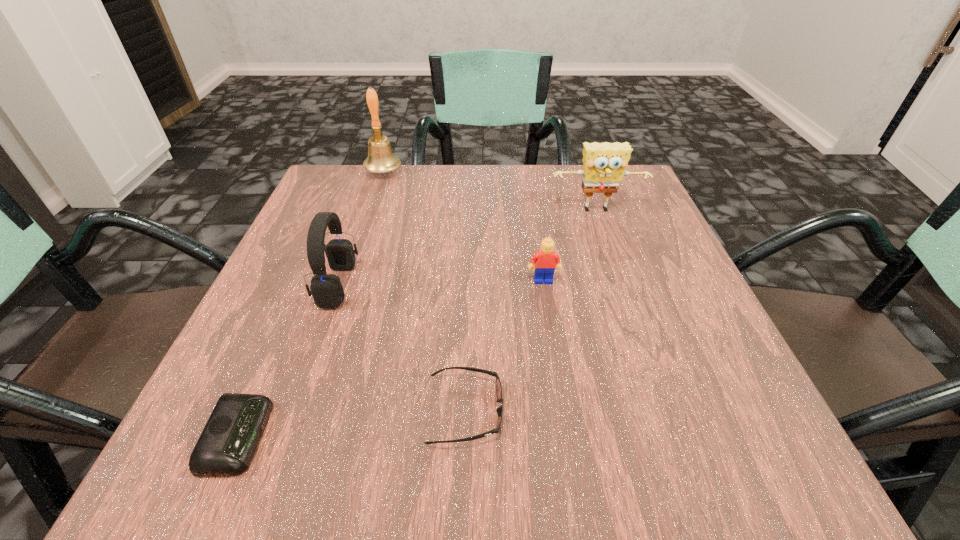
Locate an element on the screen. The height and width of the screenshot is (540, 960). headset located in the left edge section of the desktop is located at coordinates pos(327,291).

Where is `alarm clock that is positioned at the left edge`? The height and width of the screenshot is (540, 960). alarm clock that is positioned at the left edge is located at coordinates (x=229, y=440).

The width and height of the screenshot is (960, 540). I want to click on object positioned at the right edge, so click(x=604, y=164).

This screenshot has width=960, height=540. In order to click on object located in the far left corner section of the desktop in this screenshot , I will do `click(380, 159)`.

What are the coordinates of `object located in the near left corner section of the desktop` in the screenshot? It's located at (229, 440).

Identify the location of object situated at the far right corner. This screenshot has width=960, height=540. (604, 164).

What are the coordinates of `vacant space at the far edge of the desktop` in the screenshot? It's located at tap(552, 195).

The height and width of the screenshot is (540, 960). I want to click on vacant space at the left edge of the desktop, so click(x=339, y=316).

In the image, there is a desktop. Identify the location of blank space at the right edge. The width and height of the screenshot is (960, 540). (692, 312).

In order to click on vacant area at the far left corner in this screenshot , I will do `click(382, 193)`.